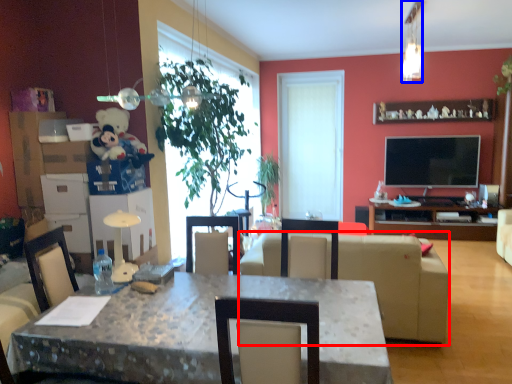
Question: Which point is closer to the camera, studio couch (highlighted by a red box) or lamp (highlighted by a blue box)?

Choices:
 (A) studio couch
 (B) lamp

Answer: (A)